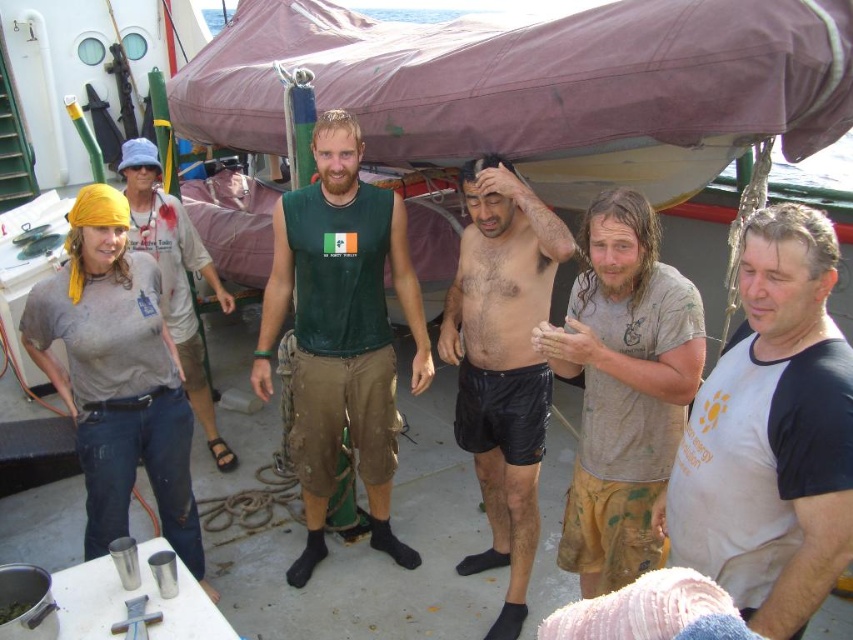
Does green sleeveless shirt at center come in front of brown cotton shirt at center?

No.

Which is below, green sleeveless shirt at center or brown cotton shirt at center?

brown cotton shirt at center is lower down.

The width and height of the screenshot is (853, 640). Identify the location of green sleeveless shirt at center. (341, 332).

Where is `green sleeveless shirt at center`? The image size is (853, 640). green sleeveless shirt at center is located at coordinates (x=341, y=332).

Is point (548, 344) farther from camera compared to point (167, 336)?

No, it is in front of (167, 336).

Between point (665, 312) and point (167, 474), which one is positioned behind?

Positioned behind is point (167, 474).

What do you see at coordinates (624, 388) in the screenshot? The height and width of the screenshot is (640, 853). I see `brown cotton shirt at center` at bounding box center [624, 388].

The image size is (853, 640). I want to click on brown cotton shirt at center, so click(x=624, y=388).

Can you confirm if brown cotton shirt at center is positioned to the left of gray cotton t-shirt at upper left?

No, brown cotton shirt at center is not to the left of gray cotton t-shirt at upper left.

Who is more forward, (610, 538) or (144, 179)?

Positioned in front is point (610, 538).

Where is `brown cotton shirt at center`? The image size is (853, 640). brown cotton shirt at center is located at coordinates (624, 388).